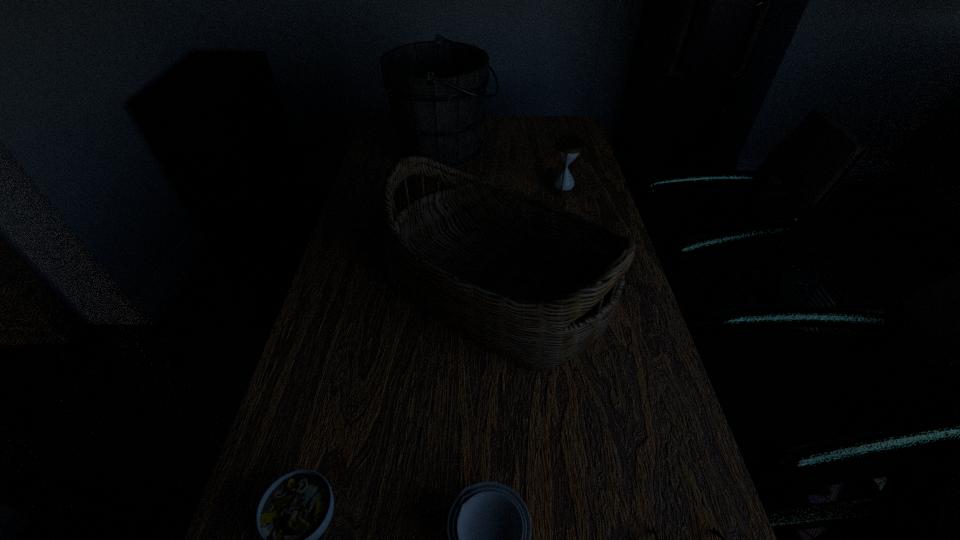
Locate an element on the screen. The height and width of the screenshot is (540, 960). bucket positioned at the left edge is located at coordinates (436, 89).

You are a GUI agent. You are given a task and a screenshot of the screen. Output one action in this format:
    pyautogui.click(x=<x>, y=<y>)
    Task: Click on the basket located in the left edge section of the desktop
    Image resolution: width=960 pixels, height=540 pixels.
    Given the screenshot: What is the action you would take?
    pyautogui.click(x=536, y=284)

You are a GUI agent. You are given a task and a screenshot of the screen. Output one action in this format:
    pyautogui.click(x=<x>, y=<y>)
    Task: Click on the basket that is at the right edge
    The width and height of the screenshot is (960, 540).
    Given the screenshot: What is the action you would take?
    pyautogui.click(x=536, y=284)

Locate an element on the screen. The image size is (960, 540). hourglass situated at the right edge is located at coordinates (568, 146).

The height and width of the screenshot is (540, 960). What are the coordinates of `object present at the far left corner` in the screenshot? It's located at (436, 89).

Identify the location of free space at the far edge. (520, 126).

The width and height of the screenshot is (960, 540). I want to click on vacant space at the left edge of the desktop, so click(x=356, y=362).

You are a GUI agent. You are given a task and a screenshot of the screen. Output one action in this format:
    pyautogui.click(x=<x>, y=<y>)
    Task: Click on the vacant region at the right edge of the desktop
    The height and width of the screenshot is (540, 960).
    Given the screenshot: What is the action you would take?
    pyautogui.click(x=591, y=179)

You are a GUI agent. You are given a task and a screenshot of the screen. Output one action in this format:
    pyautogui.click(x=<x>, y=<y>)
    Task: Click on the vacant area at the far right corner of the desktop
    This screenshot has width=960, height=540.
    Given the screenshot: What is the action you would take?
    pyautogui.click(x=582, y=134)

Point out which object is positioned as the fourth nearest to the second farthest object. Please provide its 2D coordinates. Your answer should be formatted as a tuple, i.e. [(x, y)], where the tuple contains the x and y coordinates of a point satisfying the conditions above.

[(714, 531)]